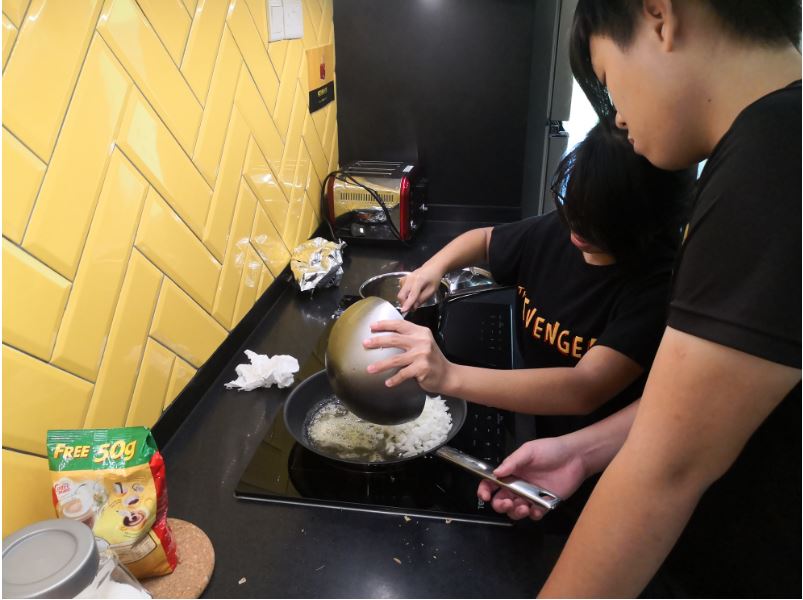
Locate an element on the screen. napkin is located at coordinates (262, 370).